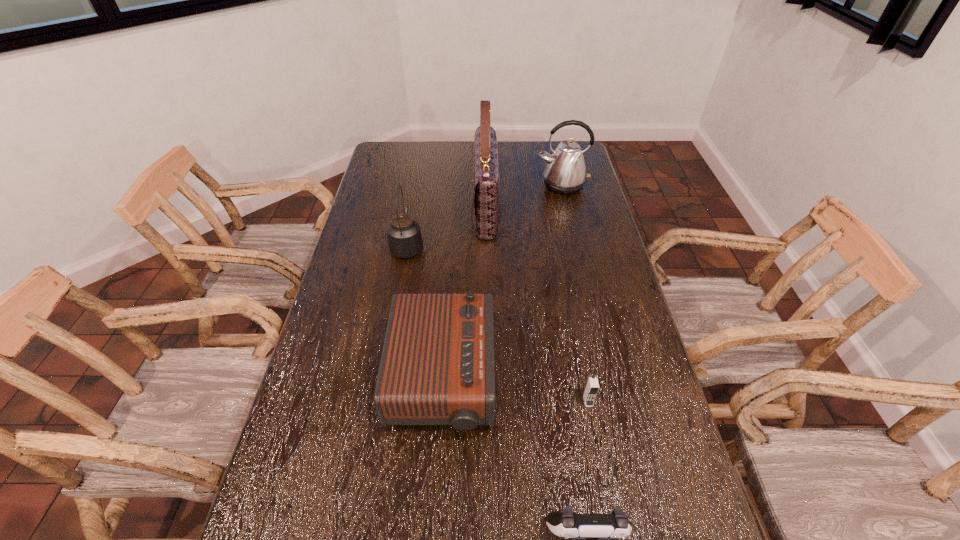
Find the location of a particular element. blank area located 0.250m spout on the nearer kettle is located at coordinates (417, 192).

The height and width of the screenshot is (540, 960). Find the location of `blank space located spout on the nearer kettle`. blank space located spout on the nearer kettle is located at coordinates (414, 210).

The height and width of the screenshot is (540, 960). I want to click on free space located on the tuning display of the radio receiver, so click(561, 379).

The width and height of the screenshot is (960, 540). I want to click on blank space located on the front-facing side of the cellular telephone, so click(605, 490).

I want to click on object present at the left edge, so click(405, 240).

I want to click on object present at the right edge, so click(565, 173).

The image size is (960, 540). I want to click on vacant point at the far edge, so click(519, 157).

You are a GUI agent. You are given a task and a screenshot of the screen. Output one action in this format:
    pyautogui.click(x=<x>, y=<y>)
    Task: Click on the vacant area at the left edge of the desktop
    This screenshot has width=960, height=540.
    Given the screenshot: What is the action you would take?
    pyautogui.click(x=373, y=315)

The width and height of the screenshot is (960, 540). I want to click on vacant space at the right edge of the desktop, so (568, 238).

This screenshot has width=960, height=540. In order to click on free space at the far left corner in this screenshot , I will do 405,144.